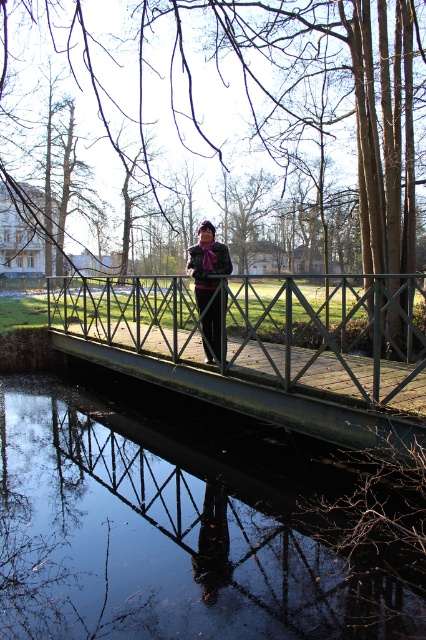
Question: Which object is closer to the camera taking this photo?

Choices:
 (A) plaid wool coat at center
 (B) green metal pedestrian bridge at center
 (C) glossy water at bridge center

Answer: (C)

Question: Where is glossy water at bridge center located in relation to plaid wool coat at center in the image?

Choices:
 (A) left
 (B) right

Answer: (A)

Question: Can you confirm if glossy water at bridge center is bigger than plaid wool coat at center?

Choices:
 (A) no
 (B) yes

Answer: (A)

Question: Is glossy water at bridge center below plaid wool coat at center?

Choices:
 (A) no
 (B) yes

Answer: (B)

Question: Which point is closer to the camera taking this photo?

Choices:
 (A) (11, 525)
 (B) (215, 314)
 (C) (180, 355)

Answer: (A)

Question: Among these objects, which one is farthest from the camera?

Choices:
 (A) glossy water at bridge center
 (B) green metal pedestrian bridge at center
 (C) plaid wool coat at center

Answer: (C)